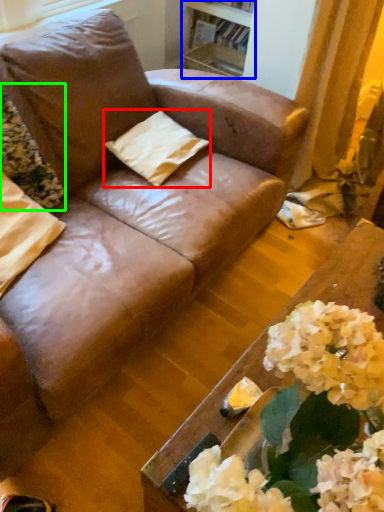
Question: Considering the real-world distances, which object is farthest from pillow (highlighted by a red box)? bookshelf (highlighted by a blue box) or flower (highlighted by a green box)?

Choices:
 (A) bookshelf
 (B) flower

Answer: (A)